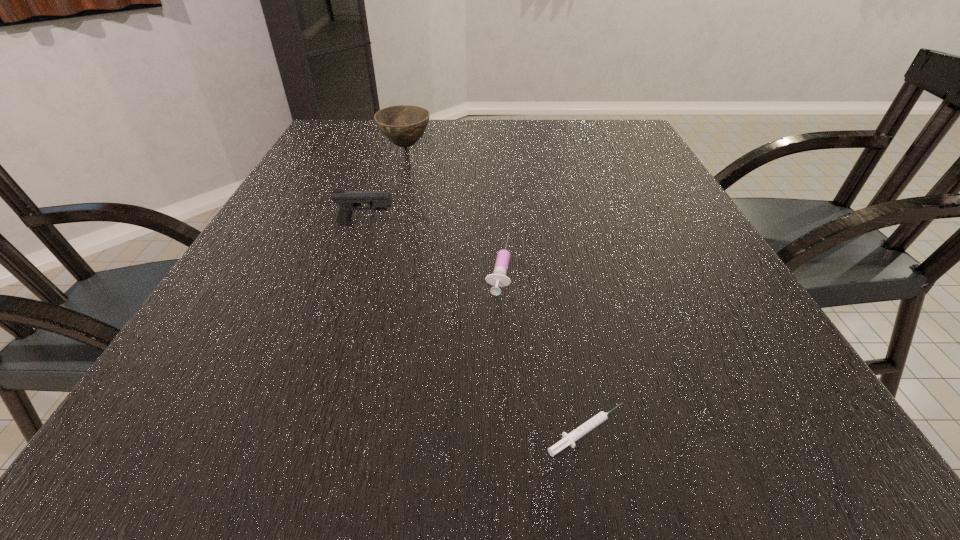
You are a GUI agent. You are given a task and a screenshot of the screen. Output one action in this format:
    pyautogui.click(x=<x>, y=<y>)
    Task: Click on the vacant point located between the second farthest object and the second object from right to left
    
    Given the screenshot: What is the action you would take?
    pyautogui.click(x=432, y=245)

The image size is (960, 540). I want to click on unoccupied area between the farthest object and the third nearest object, so click(386, 185).

Where is `vacant space that is in between the second nearest object and the farthest object`? The width and height of the screenshot is (960, 540). vacant space that is in between the second nearest object and the farthest object is located at coordinates (452, 206).

The height and width of the screenshot is (540, 960). Find the location of `vacant space that is in between the third tallest object and the second farthest object`. vacant space that is in between the third tallest object and the second farthest object is located at coordinates (432, 245).

This screenshot has height=540, width=960. Identify the location of blank region between the bowl and the second object from right to left. (452, 206).

Identify the location of free spot between the farthest object and the third nearest object. This screenshot has height=540, width=960. (386, 185).

The width and height of the screenshot is (960, 540). In order to click on vacant space in between the pistol and the farthest object in this screenshot , I will do (386, 185).

Where is `vacant space that is in between the farthest object and the taller syringe`? vacant space that is in between the farthest object and the taller syringe is located at coordinates (452, 206).

Locate an element on the screen. object that stands as the closest to the right syringe is located at coordinates (499, 279).

Where is `the closest object to the rightmost object`? the closest object to the rightmost object is located at coordinates (499, 279).